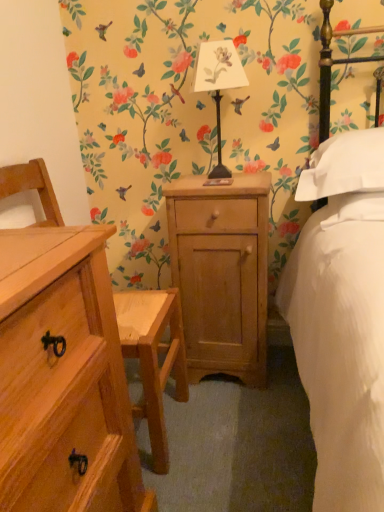
Locate an element on the screen. free space to the right of metallic black lamp at center is located at coordinates (252, 177).